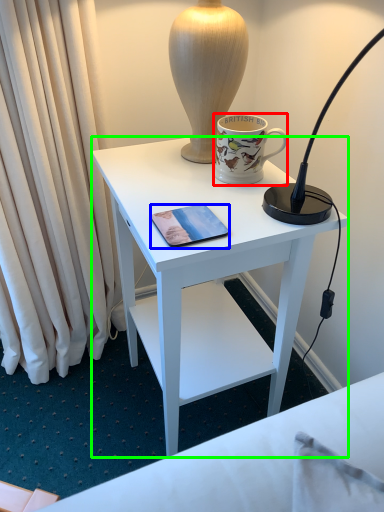
Question: Considering the real-world distances, which object is closest to coffee cup (highlighted by a red box)? mobile phone (highlighted by a blue box) or desk (highlighted by a green box).

Choices:
 (A) mobile phone
 (B) desk

Answer: (A)